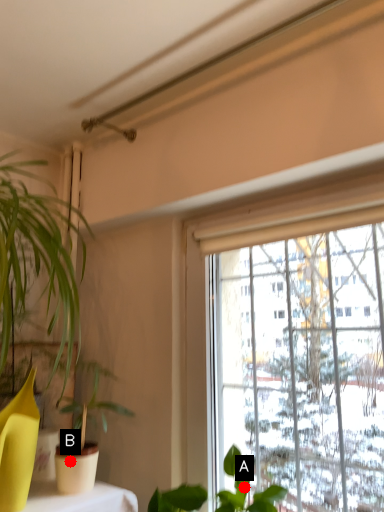
Question: Two points are circled on the image, labeled by A and B beside each circle. Which point appears closest to the camera in this image?

Choices:
 (A) A is closer
 (B) B is closer

Answer: (B)